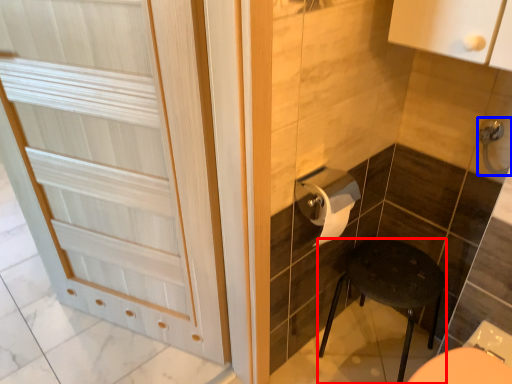
Question: Which of the following is the closest to the observer, furniture (highlighted by a red box) or door handle (highlighted by a blue box)?

Choices:
 (A) furniture
 (B) door handle

Answer: (B)